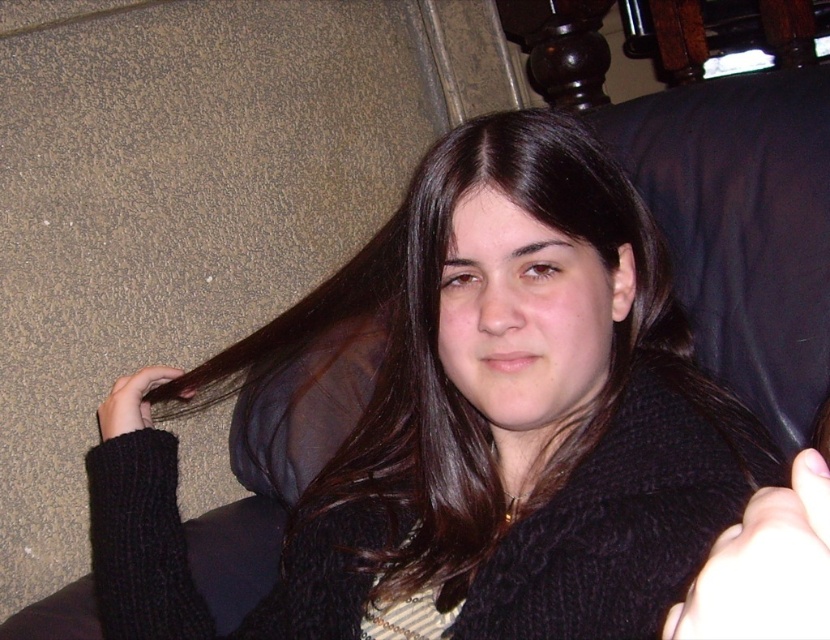
You are a photographer adjusting your camera settings. You want to focus on the dark brown hair at center and the black knitted hand at upper left. Which object should you adjust the focus on first if you want to ensure both are in sharp focus?

You should focus on the dark brown hair at center first because it is closer to the viewer than the black knitted hand at upper left, so adjusting focus starting from the closer object ensures both can be in sharp focus.

You are designing a photo frame that needs to accommodate both the dark brown hair at center and the black knitted hand at upper left. Given their sizes, which object should you prioritize placing first to ensure both fit within the frame?

The dark brown hair at center has a larger width than the black knitted hand at upper left, so you should prioritize placing the dark brown hair at center first to ensure both fit within the frame.

You are an interior designer assessing the placement of two decorative hands in a living room. The white matte hand at lower right and the black knitted hand at upper left are part of an art installation. Based on their positions, which hand appears closer to the viewer?

The white matte hand at lower right appears closer to the viewer because it has a lesser height compared to the black knitted hand at upper left, indicating it is positioned lower in the visual field.